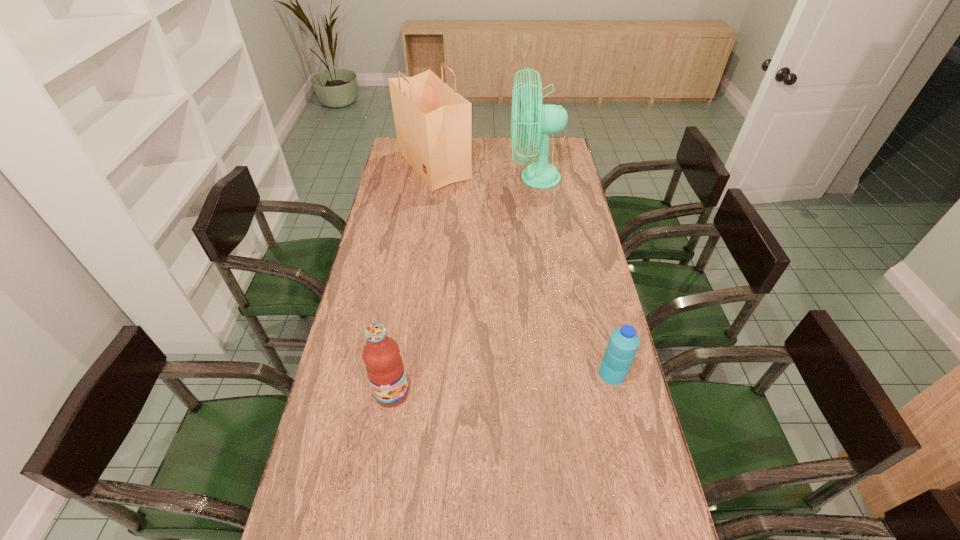
At what (x,y) coordinates should I click in order to perform the action: click on fan. Please return your answer as a coordinate pair (x, y). Looking at the image, I should click on (541, 119).

Find the location of a particular element. The width and height of the screenshot is (960, 540). grocery bag is located at coordinates (433, 122).

This screenshot has height=540, width=960. I want to click on the second shortest object, so click(384, 366).

Identify the location of the shortest object. (623, 343).

Locate an element on the screen. free spot located in front of the fan to blow air is located at coordinates (478, 178).

At what (x,y) coordinates should I click in order to perform the action: click on vacant space located in front of the fan to blow air. Please return your answer as a coordinate pair (x, y). This screenshot has height=540, width=960. Looking at the image, I should click on (487, 178).

Where is `free space located 0.290m in front of the fan to blow air`? This screenshot has height=540, width=960. free space located 0.290m in front of the fan to blow air is located at coordinates (444, 178).

Where is `free spot located on the side of the grocery bag with the superhero design`? free spot located on the side of the grocery bag with the superhero design is located at coordinates (541, 165).

Find the location of a particular element. This screenshot has height=540, width=960. free region located 0.150m on the front label of the fruit juice is located at coordinates (381, 464).

You are a GUI agent. You are given a task and a screenshot of the screen. Output one action in this format:
    pyautogui.click(x=<x>, y=<y>)
    Task: Click on the free point located on the front of the shortest object
    This screenshot has width=960, height=540.
    Given the screenshot: What is the action you would take?
    pyautogui.click(x=631, y=451)